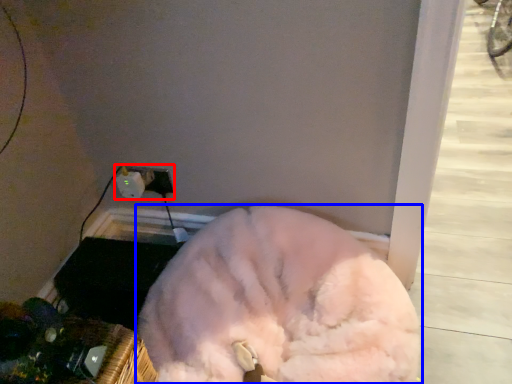
Question: Among these objects, which one is farthest to the camera, electric outlet (highlighted by a red box) or dog (highlighted by a blue box)?

Choices:
 (A) electric outlet
 (B) dog

Answer: (A)